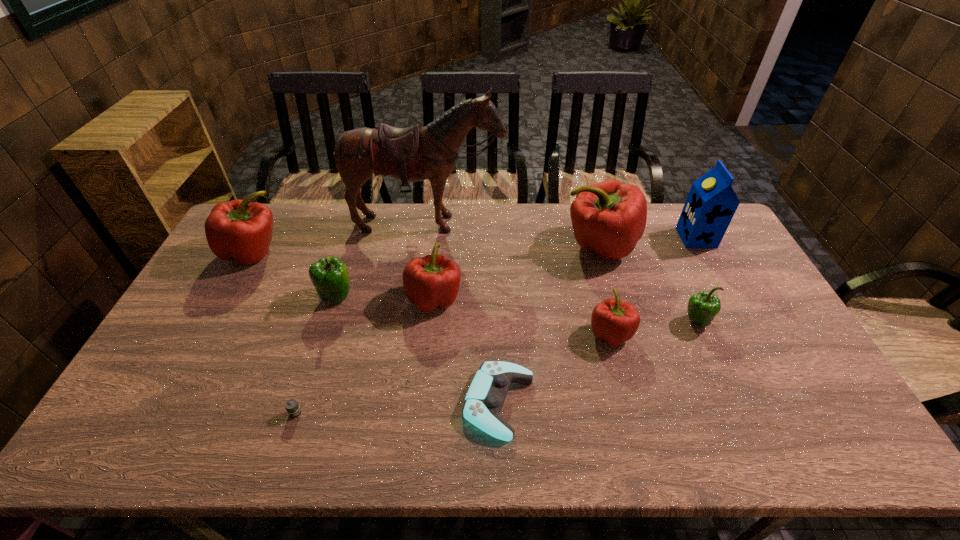
Where is `the second smallest pink bell pepper`? This screenshot has height=540, width=960. the second smallest pink bell pepper is located at coordinates (433, 281).

I want to click on the right green bell pepper, so click(x=702, y=307).

This screenshot has height=540, width=960. I want to click on the ninth object from left to right, so click(702, 307).

Identify the location of the smallest pink bell pepper. Image resolution: width=960 pixels, height=540 pixels. (613, 321).

I want to click on control, so click(486, 395).

Where is `the shortest object`? The image size is (960, 540). the shortest object is located at coordinates (292, 407).

You are a GUI agent. You are given a task and a screenshot of the screen. Output one action in this format:
    pyautogui.click(x=<x>, y=<y>)
    Task: Click on the vacant area situated 0.230m on the back of the brown saddle
    
    Given the screenshot: What is the action you would take?
    pyautogui.click(x=420, y=284)

Find the location of `vacant space situated with the cap open on the blue carton`. vacant space situated with the cap open on the blue carton is located at coordinates (570, 238).

Locate an element on the screen. This screenshot has height=540, width=960. vacant point located 0.260m with the cap open on the blue carton is located at coordinates (607, 238).

Identify the location of vacant region located 0.060m with the cap open on the blue carton. The width and height of the screenshot is (960, 540). (663, 238).